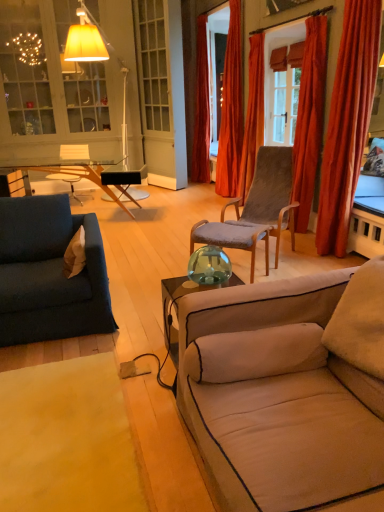
Question: Is orange velvet curtain at center, placed as the 3th curtain when sorted from back to front, at the right side of matte glass cabinet at upper left?

Choices:
 (A) no
 (B) yes

Answer: (B)

Question: From the image's perspective, is orange velvet curtain at center, placed as the 3th curtain when sorted from back to front, beneath matte glass cabinet at upper left?

Choices:
 (A) no
 (B) yes

Answer: (B)

Question: Is orange velvet curtain at center, placed as the 3th curtain when sorted from back to front, further to the viewer compared to matte glass cabinet at upper left?

Choices:
 (A) yes
 (B) no

Answer: (B)

Question: Is orange velvet curtain at center, placed as the 3th curtain when sorted from back to front, far from matte glass cabinet at upper left?

Choices:
 (A) yes
 (B) no

Answer: (A)

Question: Is orange velvet curtain at center, placed as the 3th curtain when sorted from back to front, not inside matte glass cabinet at upper left?

Choices:
 (A) no
 (B) yes

Answer: (B)

Question: Is matte glass cabinet at upper left taller or shorter than velvet orange curtain at right, which appears as the 1th curtain when viewed from the front?

Choices:
 (A) short
 (B) tall

Answer: (B)

Question: Is matte glass cabinet at upper left inside the boundaries of velvet orange curtain at right, marked as the fifth curtain in a back-to-front arrangement, or outside?

Choices:
 (A) outside
 (B) inside

Answer: (A)

Question: Would you say matte glass cabinet at upper left is to the left or to the right of velvet orange curtain at right, which appears as the 1th curtain when viewed from the front, in the picture?

Choices:
 (A) left
 (B) right

Answer: (A)

Question: From the image's perspective, relative to velvet orange curtain at right, marked as the fifth curtain in a back-to-front arrangement, is matte glass cabinet at upper left above or below?

Choices:
 (A) above
 (B) below

Answer: (A)

Question: From a real-world perspective, relative to velvet orange curtain at right, marked as the fifth curtain in a back-to-front arrangement, is beige carpet at lower left vertically above or below?

Choices:
 (A) below
 (B) above

Answer: (A)

Question: Looking at their shapes, would you say beige carpet at lower left is wider or thinner than velvet orange curtain at right, which appears as the 1th curtain when viewed from the front?

Choices:
 (A) wide
 (B) thin

Answer: (A)

Question: Do you think beige carpet at lower left is within velvet orange curtain at right, which appears as the 1th curtain when viewed from the front, or outside of it?

Choices:
 (A) inside
 (B) outside

Answer: (B)

Question: From the image's perspective, relative to velvet orange curtain at right, marked as the fifth curtain in a back-to-front arrangement, is beige carpet at lower left above or below?

Choices:
 (A) above
 (B) below

Answer: (B)

Question: Considering the positions of matte glass cabinet at upper left and beige fabric couch at lower right, which is counted as the first studio couch, starting from the front, in the image, is matte glass cabinet at upper left wider or thinner than beige fabric couch at lower right, which is counted as the first studio couch, starting from the front,?

Choices:
 (A) wide
 (B) thin

Answer: (B)

Question: Considering the positions of point (29, 5) and point (355, 428), is point (29, 5) closer or farther from the camera than point (355, 428)?

Choices:
 (A) farther
 (B) closer

Answer: (A)